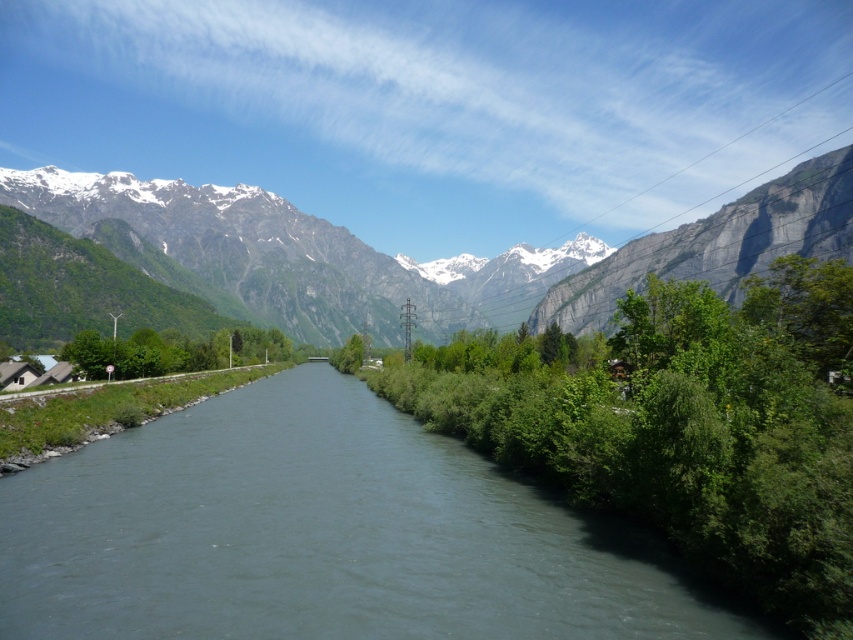
You are a hiker planning to cross the green grassy river at center and then climb the gray rock cliff at upper right. Considering their sizes, which one do you think requires more physical effort?

The gray rock cliff at upper right requires more physical effort because it has a larger size compared to the green grassy river at center.

You are standing at the point marked as point (344,285) in the image. You want to cross the river to reach the other side. The river is 100 meters wide. Can you safely cross it at this point?

The distance between you and the viewer is 479.94 meters, but the river is only 100 meters wide. Since the point is on the riverbank, you can safely cross the river at this point as the width is manageable.

You are a hiker standing at the point closer to the mountains. You see two points marked in the landscape, point A at coordinates point A is point (573,278) and point B at point (746,269). Which point is closer to you?

Point A at coordinates point A is point (573,278) is closer to you because it is further to the viewer than point B at point (746,269).